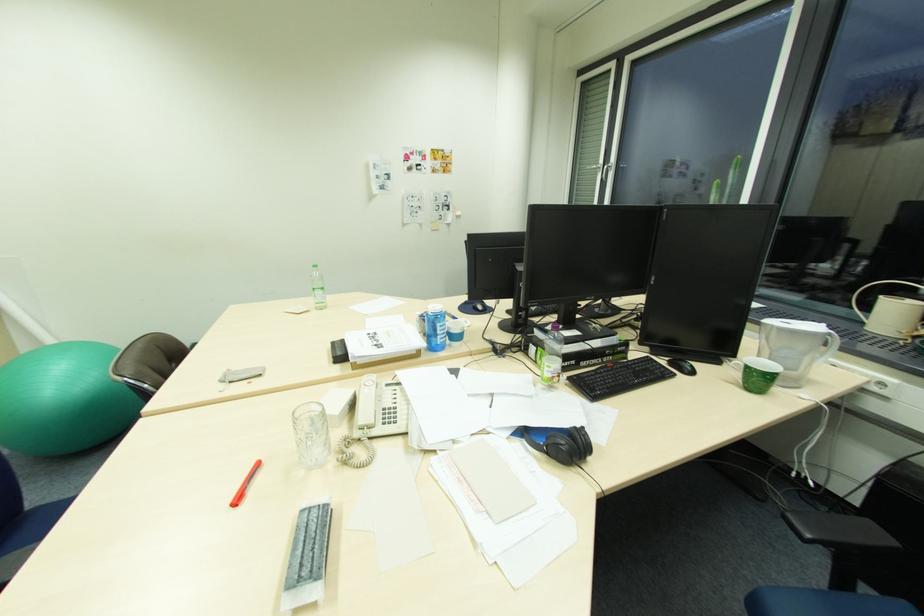
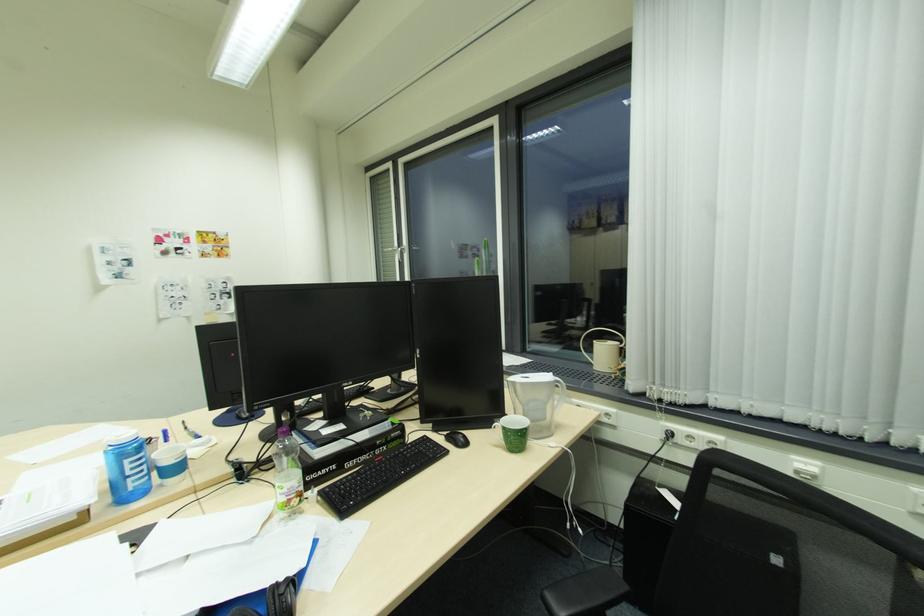
In the second image, find the point that corresponds to (x=392, y=177) in the first image.

(131, 262)